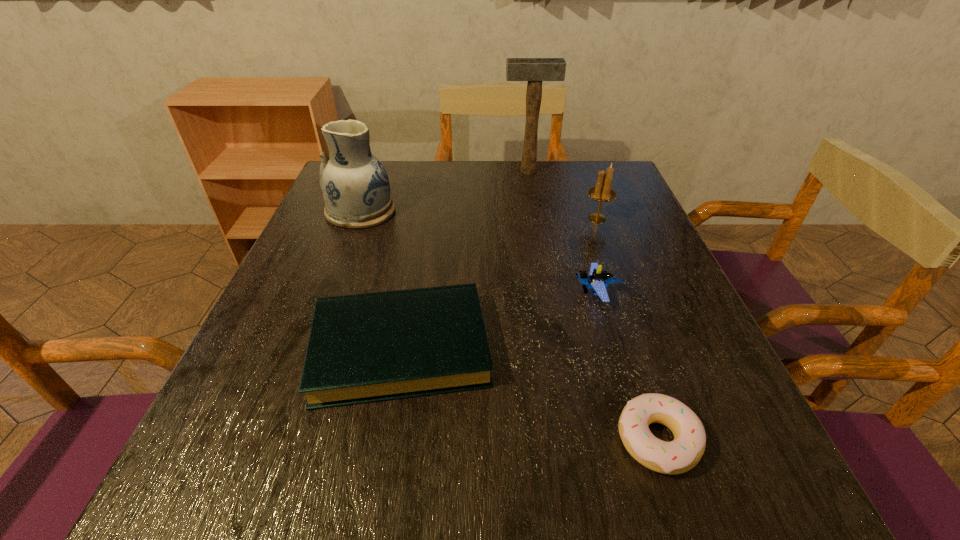
I want to click on vacant space located on the front-facing side of the Lego, so click(529, 293).

Where is `free spot located 0.370m on the front-facing side of the Lego`? The height and width of the screenshot is (540, 960). free spot located 0.370m on the front-facing side of the Lego is located at coordinates (390, 293).

Locate an element on the screen. free location located 0.320m on the front-facing side of the Lego is located at coordinates (415, 293).

Locate an element on the screen. vacant space located 0.210m on the back of the book is located at coordinates (420, 237).

Image resolution: width=960 pixels, height=540 pixels. What are the coordinates of `free space located on the left of the doughnut` in the screenshot? It's located at (543, 440).

Identify the location of mallet present at the far edge. The image size is (960, 540). (534, 70).

This screenshot has width=960, height=540. Find the location of `pottery positioned at the far edge`. pottery positioned at the far edge is located at coordinates (356, 190).

Locate an element on the screen. The height and width of the screenshot is (540, 960). object present at the near edge is located at coordinates (683, 453).

The height and width of the screenshot is (540, 960). In order to click on pottery positioned at the left edge in this screenshot , I will do `click(356, 190)`.

Locate an element on the screen. book that is at the left edge is located at coordinates (369, 347).